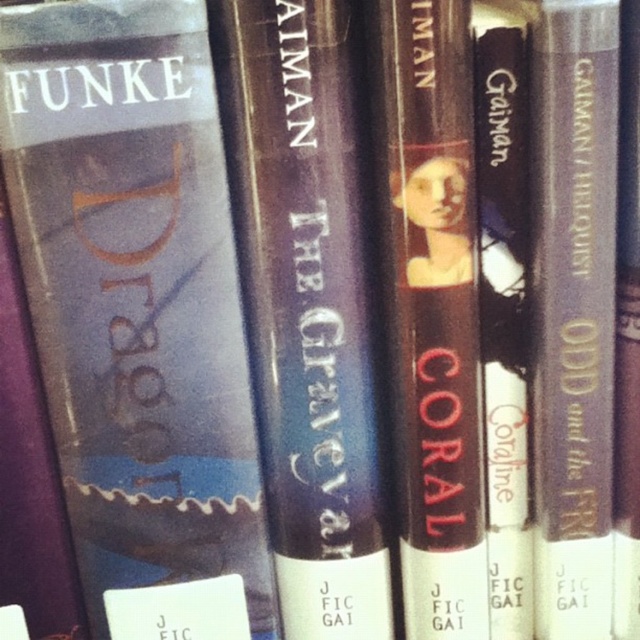
The width and height of the screenshot is (640, 640). Describe the element at coordinates (134, 304) in the screenshot. I see `matte blue book at center` at that location.

Is matte blue book at center positioned in front of matte brown book at center?

Yes, it is.

At what (x,y) coordinates should I click in order to perform the action: click on matte blue book at center. Please return your answer as a coordinate pair (x, y). The width and height of the screenshot is (640, 640). Looking at the image, I should click on (134, 304).

You are a GUI agent. You are given a task and a screenshot of the screen. Output one action in this format:
    pyautogui.click(x=<x>, y=<y>)
    Task: Click on the matte blue book at center
    This screenshot has width=640, height=640.
    Given the screenshot: What is the action you would take?
    pyautogui.click(x=134, y=304)

Is matte blue book at center positioned in front of shiny purple book at center?

Yes, it is in front of shiny purple book at center.

Is matte blue book at center smaller than shiny purple book at center?

Actually, matte blue book at center might be larger than shiny purple book at center.

Find the location of a particular element. matte blue book at center is located at coordinates (134, 304).

Who is higher up, matte blue book at center or matte black book at center?

matte black book at center

Where is `matte blue book at center`? The image size is (640, 640). matte blue book at center is located at coordinates (134, 304).